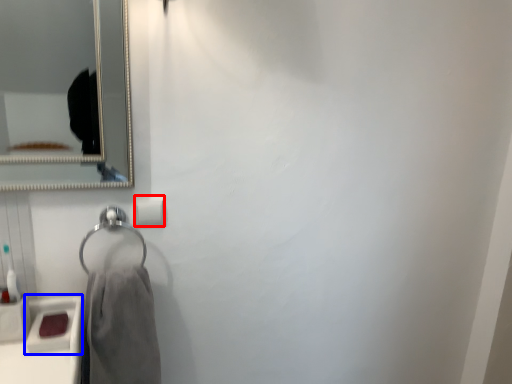
Question: Which object is closer to the camera taking this photo, toilet paper (highlighted by a red box) or sink (highlighted by a blue box)?

Choices:
 (A) toilet paper
 (B) sink

Answer: (B)